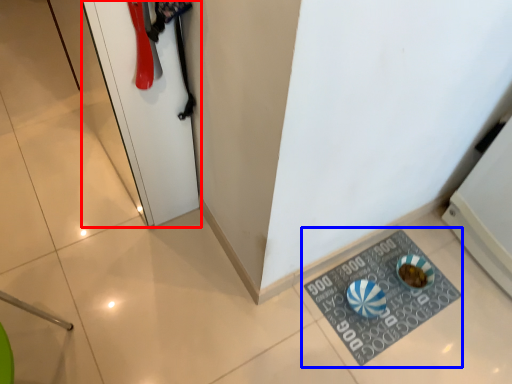
Question: Which object is closer to the camera taking this photo, door (highlighted by a red box) or doormat (highlighted by a blue box)?

Choices:
 (A) door
 (B) doormat

Answer: (A)